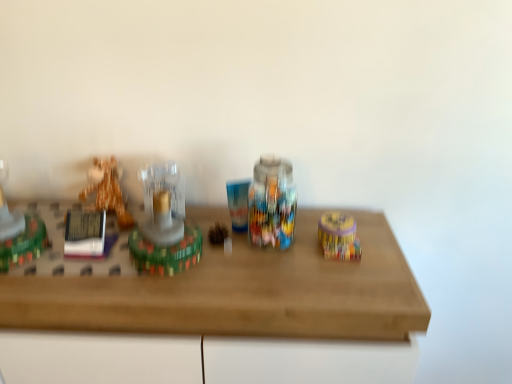
Identify the location of free point to the right of matte yellow container at right, which is counted as the first toy, starting from the right. (374, 238).